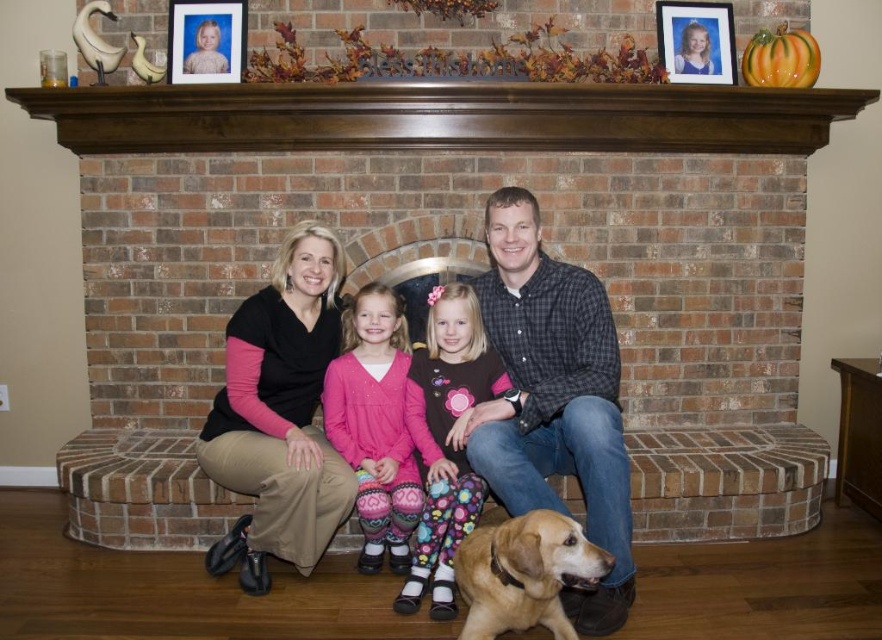
Question: Where is brick fireplace at center located in relation to matte plastic picture frame at upper right in the image?

Choices:
 (A) right
 (B) left

Answer: (B)

Question: Which point is closer to the camera taking this photo?

Choices:
 (A) (536, 392)
 (B) (170, 230)
 (C) (167, 64)
 (D) (230, 417)

Answer: (A)

Question: In this image, where is checkered shirt at center located relative to golden fur dog at lower center?

Choices:
 (A) left
 (B) right

Answer: (B)

Question: Does brick fireplace at center come behind pink fleece dress at center?

Choices:
 (A) yes
 (B) no

Answer: (A)

Question: Which object is closer to the camera taking this photo?

Choices:
 (A) brick fireplace at center
 (B) matte black shirt at center
 (C) matte plastic picture frame at upper right

Answer: (B)

Question: Which point is farther from the camera taking this photo?

Choices:
 (A) (550, 580)
 (B) (495, 96)

Answer: (B)